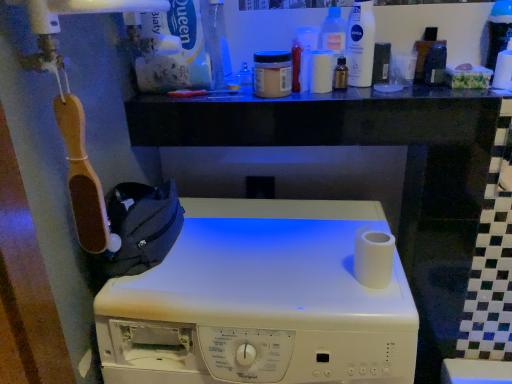
The height and width of the screenshot is (384, 512). Identify the location of vacant space situated above white plastic washing machine at center (from a real-world perspective). (255, 261).